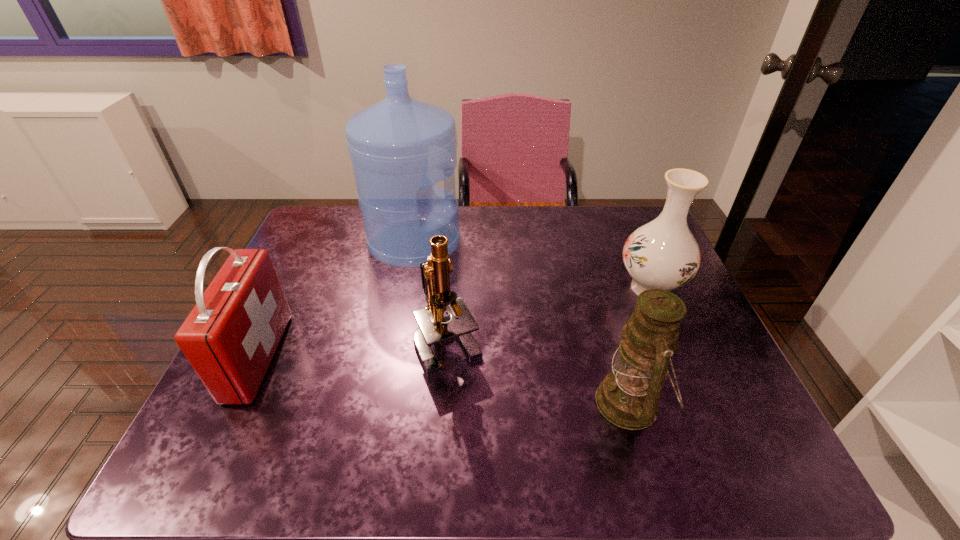
Identify the location of water jug. The width and height of the screenshot is (960, 540). (400, 147).

Identify the location of vase. The image size is (960, 540). (663, 254).

Where is `microscope`? This screenshot has height=540, width=960. microscope is located at coordinates coord(434,327).

Where is `oil lamp`? The height and width of the screenshot is (540, 960). oil lamp is located at coordinates (628, 397).

What are the coordinates of `the leftmost object` in the screenshot? It's located at (230, 337).

In order to click on vacant space located on the side of the tallest object with the handle in this screenshot , I will do `click(487, 242)`.

Find the location of a particular element. This screenshot has height=540, width=960. vacant space located on the front of the vase is located at coordinates (710, 427).

The image size is (960, 540). What are the coordinates of `vacant point located 0.170m at the eyepiece of the microscope` in the screenshot? It's located at (441, 450).

This screenshot has width=960, height=540. In order to click on free space located on the back of the oil lamp in this screenshot , I will do `click(608, 326)`.

You are a GUI agent. You are given a task and a screenshot of the screen. Output one action in this format:
    pyautogui.click(x=<x>, y=<y>)
    Task: Click on the vacant space located on the front face of the first-aid kit
    This screenshot has width=960, height=540.
    Given the screenshot: What is the action you would take?
    click(x=354, y=356)